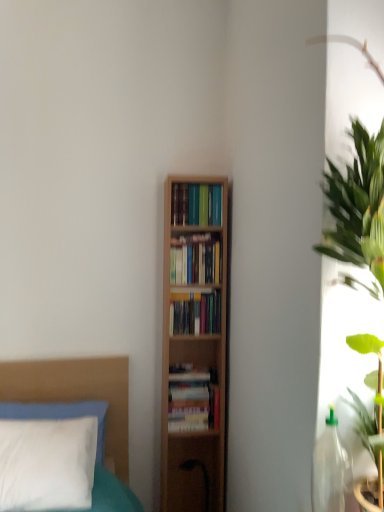
Identify the location of free location above hardcover books at center, the 3th book when ordered from top to bottom (from a real-world perspective). The height and width of the screenshot is (512, 384). (198, 296).